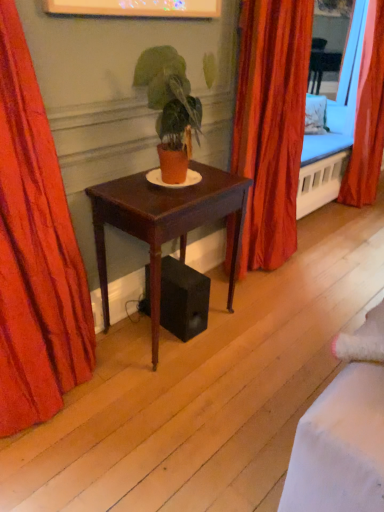
Question: Is there a large distance between velvet red curtain at left, the third curtain in the back-to-front sequence, and mahogany wood desk at center?

Choices:
 (A) yes
 (B) no

Answer: (B)

Question: From the image's perspective, is velvet red curtain at left, the first curtain when ordered from front to back, beneath mahogany wood desk at center?

Choices:
 (A) no
 (B) yes

Answer: (A)

Question: Is velvet red curtain at left, the first curtain when ordered from front to back, facing towards mahogany wood desk at center?

Choices:
 (A) yes
 (B) no

Answer: (B)

Question: Is velvet red curtain at left, placed as the 3th curtain when sorted from right to left, closer to camera compared to mahogany wood desk at center?

Choices:
 (A) no
 (B) yes

Answer: (B)

Question: Is velvet red curtain at left, placed as the 3th curtain when sorted from right to left, outside of mahogany wood desk at center?

Choices:
 (A) no
 (B) yes

Answer: (B)

Question: Is velvet red curtain at left, the third curtain in the back-to-front sequence, smaller than mahogany wood desk at center?

Choices:
 (A) no
 (B) yes

Answer: (A)

Question: From a real-world perspective, is matte orange pot at center beneath orange fabric curtain at right, which ranks as the 3th curtain in front-to-back order?

Choices:
 (A) yes
 (B) no

Answer: (B)

Question: Is matte orange pot at center beside orange fabric curtain at right, placed as the third curtain when sorted from left to right?

Choices:
 (A) no
 (B) yes

Answer: (A)

Question: Is matte orange pot at center not within orange fabric curtain at right, which ranks as the 3th curtain in front-to-back order?

Choices:
 (A) yes
 (B) no

Answer: (A)

Question: Does matte orange pot at center have a lesser height compared to orange fabric curtain at right, placed as the third curtain when sorted from left to right?

Choices:
 (A) no
 (B) yes

Answer: (B)

Question: Can you confirm if matte orange pot at center is positioned to the right of orange fabric curtain at right, the 1th curtain positioned from the back?

Choices:
 (A) no
 (B) yes

Answer: (A)

Question: Is matte orange pot at center smaller than orange fabric curtain at right, which ranks as the 3th curtain in front-to-back order?

Choices:
 (A) yes
 (B) no

Answer: (A)

Question: From a real-world perspective, is orange fabric curtain at right, which ranks as the 3th curtain in front-to-back order, below silky orange curtain at center, which appears as the 2th curtain when viewed from the left?

Choices:
 (A) no
 (B) yes

Answer: (A)